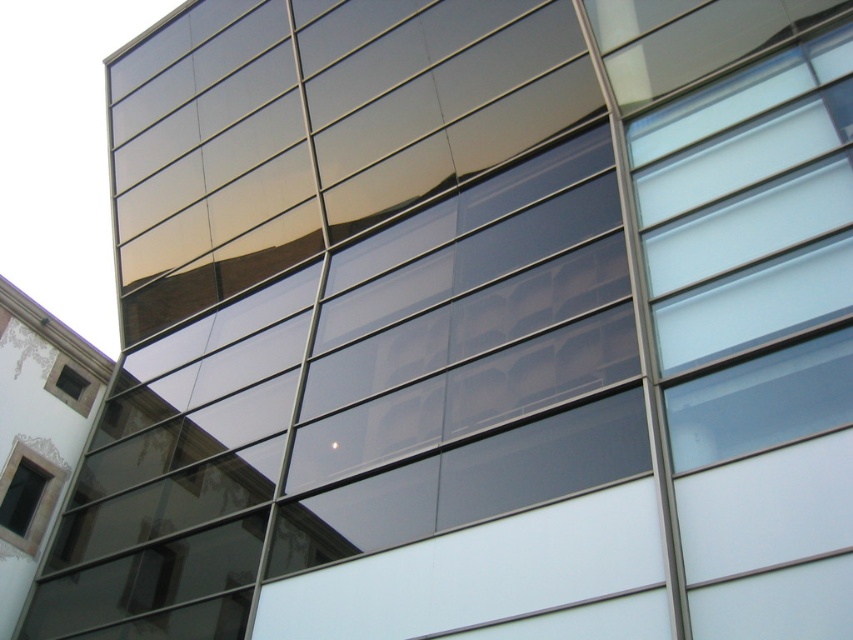
Question: Can you confirm if matte glass window at lower left is smaller than matte black window at lower left?

Choices:
 (A) yes
 (B) no

Answer: (B)

Question: In this image, where is matte glass window at lower left located relative to matte black window at lower left?

Choices:
 (A) left
 (B) right

Answer: (A)

Question: Which object appears farthest from the camera in this image?

Choices:
 (A) matte glass window at lower left
 (B) matte black window at lower left

Answer: (B)

Question: Which point is farther from the camera taking this photo?

Choices:
 (A) (41, 477)
 (B) (67, 387)

Answer: (B)

Question: Does matte glass window at lower left have a greater width compared to matte black window at lower left?

Choices:
 (A) yes
 (B) no

Answer: (A)

Question: Which of the following is the closest to the observer?

Choices:
 (A) (10, 509)
 (B) (61, 371)

Answer: (A)